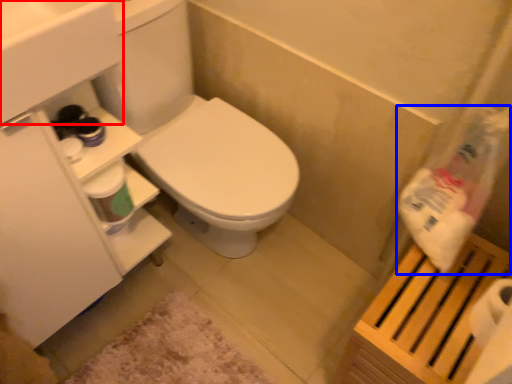
Question: Which object is closer to the camera taking this photo, sink (highlighted by a red box) or cleaning product (highlighted by a blue box)?

Choices:
 (A) sink
 (B) cleaning product

Answer: (A)